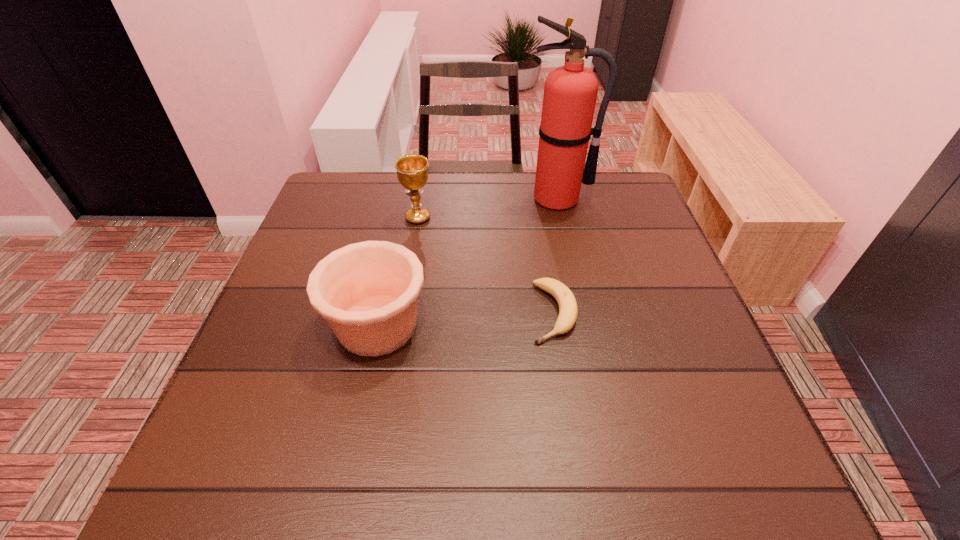
Where is `free space between the shortest object and the fire extinguisher`? free space between the shortest object and the fire extinguisher is located at coordinates (556, 256).

Locate an element on the screen. The height and width of the screenshot is (540, 960). free spot between the banana and the second tallest object is located at coordinates (486, 265).

Image resolution: width=960 pixels, height=540 pixels. Find the location of `free point between the tallest object and the banana`. free point between the tallest object and the banana is located at coordinates (556, 256).

Find the location of `empty space that is in between the second shortest object and the banana`. empty space that is in between the second shortest object and the banana is located at coordinates (466, 319).

Where is `free point between the fire extinguisher and the third tallest object`? The width and height of the screenshot is (960, 540). free point between the fire extinguisher and the third tallest object is located at coordinates coord(468,262).

I want to click on empty location between the banana and the pottery, so click(466, 319).

Where is `free space between the shortest object and the tallest object`? This screenshot has height=540, width=960. free space between the shortest object and the tallest object is located at coordinates (556, 256).

I want to click on vacant space in between the tallest object and the pottery, so click(468, 262).

Select which object appears as the closest to the shortest object. Please provide its 2D coordinates. Your answer should be formatted as a tuple, i.e. [(x, y)], where the tuple contains the x and y coordinates of a point satisfying the conditions above.

[(368, 292)]

Locate which object ranks in proximity to the third tallest object. Please provide its 2D coordinates. Your answer should be formatted as a tuple, i.e. [(x, y)], where the tuple contains the x and y coordinates of a point satisfying the conditions above.

[(568, 311)]